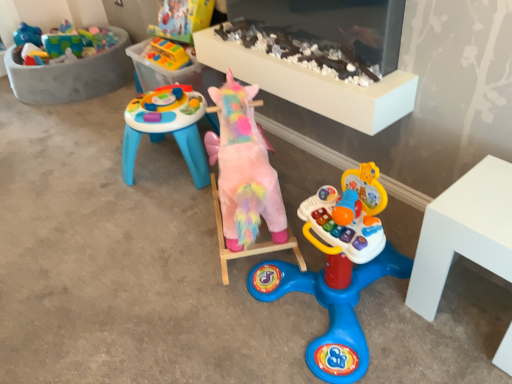
Question: Are pastel plush unicorn at center, marked as the second toy in a bottom-to-top arrangement, and fluffy pink unicorn at center, which is the 1th toy from bottom to top, far apart?

Choices:
 (A) yes
 (B) no

Answer: (B)

Question: From the image's perspective, would you say pastel plush unicorn at center, marked as the second toy in a bottom-to-top arrangement, is shown under fluffy pink unicorn at center, the third toy positioned from the top?

Choices:
 (A) no
 (B) yes

Answer: (A)

Question: From a real-world perspective, does pastel plush unicorn at center, positioned as the 2th toy in top-to-bottom order, stand above fluffy pink unicorn at center, the third toy positioned from the top?

Choices:
 (A) no
 (B) yes

Answer: (B)

Question: Is pastel plush unicorn at center, positioned as the 2th toy in top-to-bottom order, at the left side of fluffy pink unicorn at center, the third toy positioned from the top?

Choices:
 (A) no
 (B) yes

Answer: (A)

Question: Is pastel plush unicorn at center, marked as the second toy in a bottom-to-top arrangement, looking in the opposite direction of fluffy pink unicorn at center, the third toy positioned from the top?

Choices:
 (A) yes
 (B) no

Answer: (B)

Question: Considering the positions of pastel plush unicorn at center, positioned as the 2th toy in top-to-bottom order, and fluffy pink unicorn at center, which is the 1th toy from bottom to top, in the image, is pastel plush unicorn at center, positioned as the 2th toy in top-to-bottom order, taller or shorter than fluffy pink unicorn at center, which is the 1th toy from bottom to top,?

Choices:
 (A) tall
 (B) short

Answer: (B)

Question: Visually, is pastel plush unicorn at center, marked as the second toy in a bottom-to-top arrangement, positioned to the left or to the right of fluffy pink unicorn at center, the third toy positioned from the top?

Choices:
 (A) right
 (B) left

Answer: (A)

Question: From the image's perspective, is pastel plush unicorn at center, positioned as the 2th toy in top-to-bottom order, above or below fluffy pink unicorn at center, which is the 1th toy from bottom to top?

Choices:
 (A) above
 (B) below

Answer: (A)

Question: Is pastel plush unicorn at center, positioned as the 2th toy in top-to-bottom order, wider or thinner than fluffy pink unicorn at center, which is the 1th toy from bottom to top?

Choices:
 (A) wide
 (B) thin

Answer: (B)

Question: From the image's perspective, is rubberized plastic toy at upper center, which is the 1th toy in top-to-bottom order, above or below pastel plush unicorn at center, positioned as the 2th toy in top-to-bottom order?

Choices:
 (A) below
 (B) above

Answer: (B)

Question: In the image, is rubberized plastic toy at upper center, acting as the third toy starting from the bottom, on the left side or the right side of pastel plush unicorn at center, positioned as the 2th toy in top-to-bottom order?

Choices:
 (A) right
 (B) left

Answer: (B)

Question: Considering the positions of point (145, 57) and point (278, 36), is point (145, 57) closer or farther from the camera than point (278, 36)?

Choices:
 (A) farther
 (B) closer

Answer: (A)

Question: Is rubberized plastic toy at upper center, acting as the third toy starting from the bottom, inside or outside of pastel plush unicorn at center, marked as the second toy in a bottom-to-top arrangement?

Choices:
 (A) inside
 (B) outside

Answer: (B)

Question: Would you say rubberized plastic toy at upper center, acting as the third toy starting from the bottom, is to the left or to the right of fluffy pink unicorn at center, the third toy positioned from the top, in the picture?

Choices:
 (A) right
 (B) left

Answer: (B)

Question: Is rubberized plastic toy at upper center, acting as the third toy starting from the bottom, in front of or behind fluffy pink unicorn at center, which is the 1th toy from bottom to top, in the image?

Choices:
 (A) behind
 (B) front

Answer: (A)